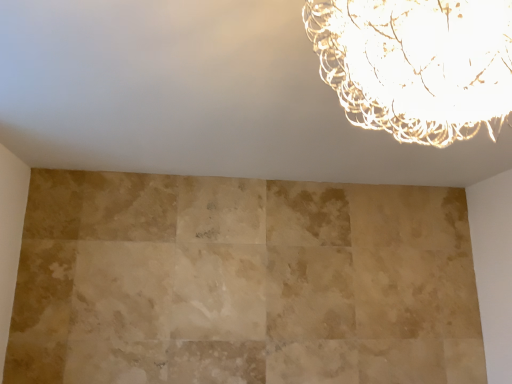
Find the location of a particular element. This screenshot has width=512, height=384. translucent glass chandelier at upper center is located at coordinates (417, 64).

The height and width of the screenshot is (384, 512). What do you see at coordinates (417, 64) in the screenshot?
I see `translucent glass chandelier at upper center` at bounding box center [417, 64].

You are a GUI agent. You are given a task and a screenshot of the screen. Output one action in this format:
    pyautogui.click(x=<x>, y=<y>)
    Task: Click on the translucent glass chandelier at upper center
    This screenshot has width=512, height=384.
    Given the screenshot: What is the action you would take?
    pyautogui.click(x=417, y=64)